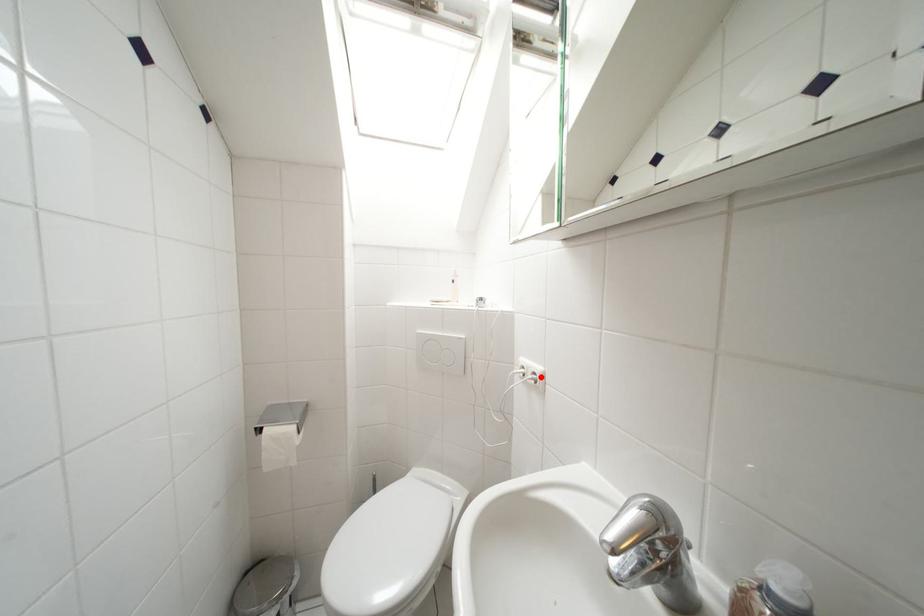
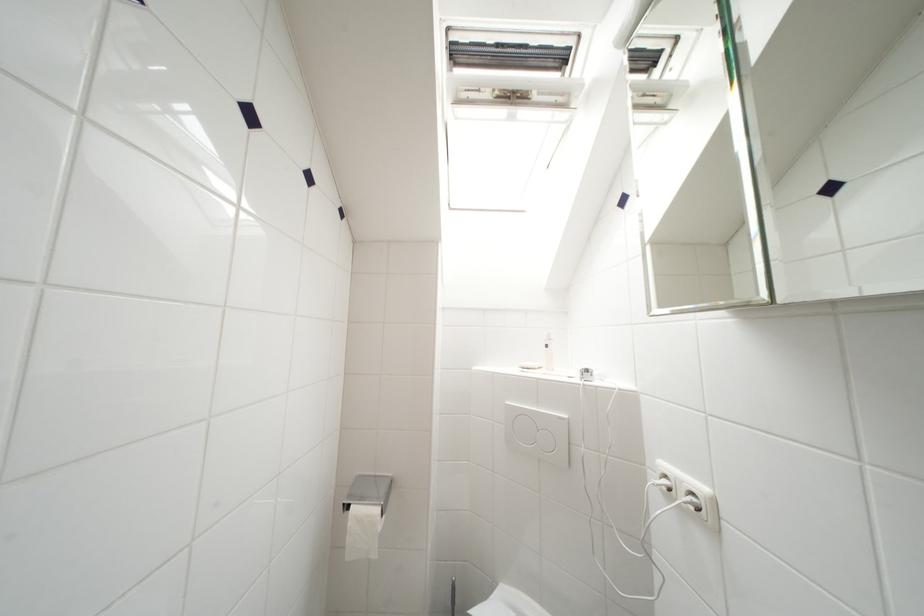
Find the pixel in the second image that matches the highlighted location in the first image.

(699, 498)